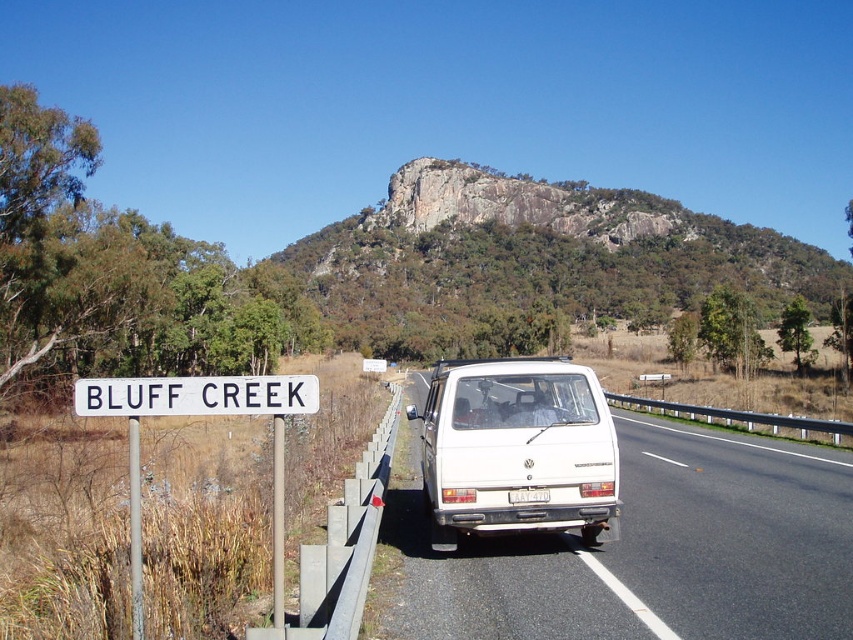
Question: Does white plastic van at center appear under rugged rock formation at center?

Choices:
 (A) no
 (B) yes

Answer: (B)

Question: Is white plastic van at center to the right of white plastic sign at left from the viewer's perspective?

Choices:
 (A) yes
 (B) no

Answer: (A)

Question: Does white plastic van at center appear over white plastic sign at upper center?

Choices:
 (A) yes
 (B) no

Answer: (B)

Question: Which point is closer to the camera?

Choices:
 (A) white matte van at center
 (B) white plastic sign at upper center
 (C) rugged rock formation at center
 (D) white plastic van at center

Answer: (B)

Question: Among these objects, which one is farthest from the camera?

Choices:
 (A) rugged rock formation at center
 (B) white plastic sign at left
 (C) white plastic van at center

Answer: (A)

Question: Which of the following is the farthest from the observer?

Choices:
 (A) white plastic van at center
 (B) white matte van at center

Answer: (B)